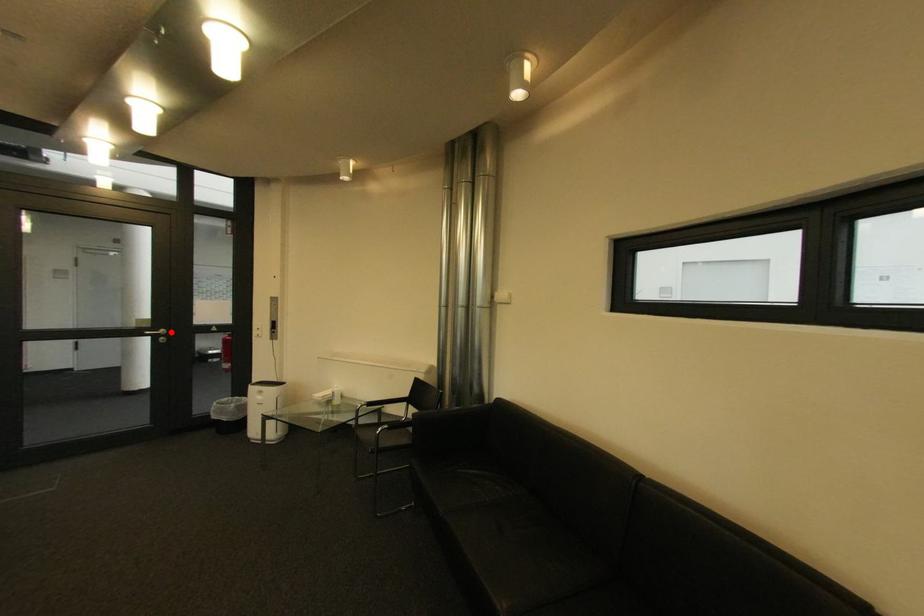
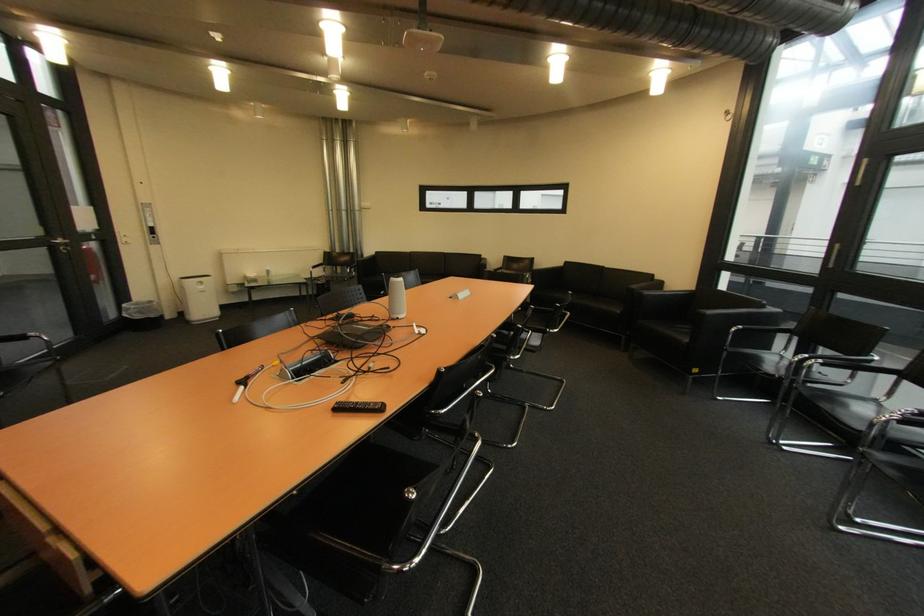
Question: I am providing you with two images of the same scene from different viewpoints. A red point is shown in image1. For the corresponding object point in image2, is it positioned nearer or farther from the camera?

Choices:
 (A) Nearer
 (B) Farther

Answer: (B)